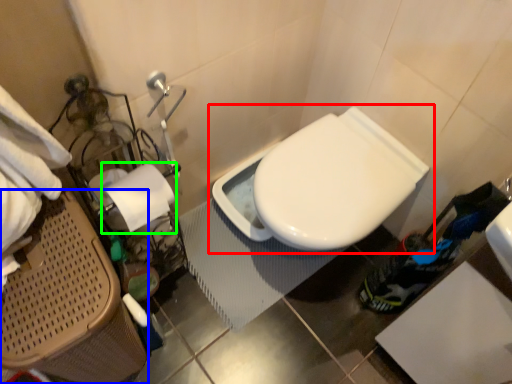
Question: Considering the real-world distances, which object is closest to toilet (highlighted by a red box)? laundry basket (highlighted by a blue box) or toilet paper (highlighted by a green box).

Choices:
 (A) laundry basket
 (B) toilet paper

Answer: (B)